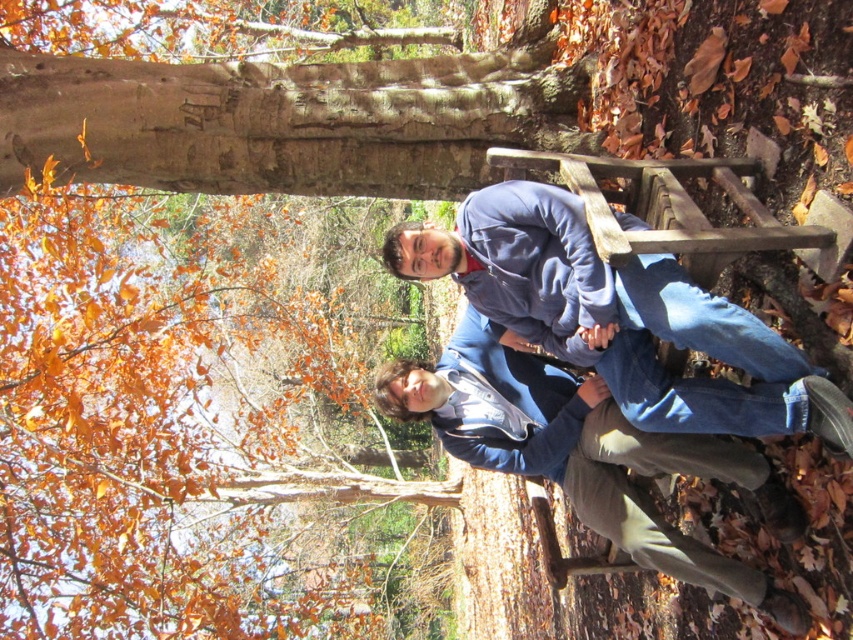
Question: Is blue fleece jacket at center bigger than blue denim jacket at center?

Choices:
 (A) no
 (B) yes

Answer: (A)

Question: Does blue fleece jacket at center lie behind blue denim jacket at center?

Choices:
 (A) no
 (B) yes

Answer: (A)

Question: Which point is closer to the camera?

Choices:
 (A) (544, 284)
 (B) (728, 564)

Answer: (A)

Question: Which point appears farthest from the camera in this image?

Choices:
 (A) (532, 364)
 (B) (566, 330)

Answer: (A)

Question: Does blue fleece jacket at center appear under blue denim jacket at center?

Choices:
 (A) yes
 (B) no

Answer: (B)

Question: Among these points, which one is farthest from the camera?

Choices:
 (A) (683, 387)
 (B) (619, 513)

Answer: (B)